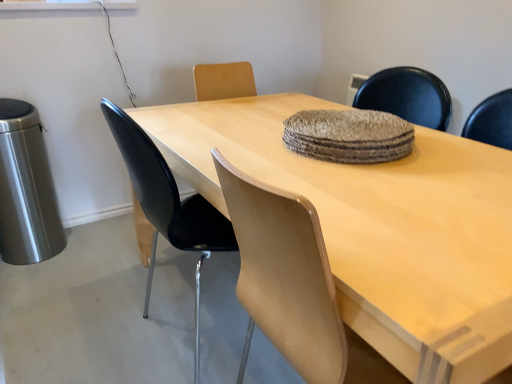
The height and width of the screenshot is (384, 512). Describe the element at coordinates (379, 228) in the screenshot. I see `light wood table at center` at that location.

The width and height of the screenshot is (512, 384). I want to click on textured woven mat at center, so click(349, 136).

The height and width of the screenshot is (384, 512). I want to click on black plastic chair at left, so click(x=168, y=205).

From a real-world perspective, between light wood table at center and black plastic chair at left, who is vertically higher?

black plastic chair at left, from a real-world perspective.

Based on the photo, can you confirm if light wood table at center is positioned to the left of black plastic chair at left?

Incorrect, light wood table at center is not on the left side of black plastic chair at left.

Is light wood table at center positioned in front of black plastic chair at left?

Yes, it is.

Is point (162, 196) positioned before point (396, 138)?

Yes, point (162, 196) is in front of point (396, 138).

Can textured woven mat at center be found inside black plastic chair at left?

→ That's incorrect, textured woven mat at center is not inside black plastic chair at left.

How many degrees apart are the facing directions of black plastic chair at left and textured woven mat at center?

The angle between the facing direction of black plastic chair at left and the facing direction of textured woven mat at center is 179 degrees.

From a real-world perspective, who is located higher, black plastic chair at left or textured woven mat at center?

textured woven mat at center is physically above.

Does point (345, 254) come closer to viewer compared to point (406, 145)?

Yes.

Is light wood table at center placed right next to textured woven mat at center?

light wood table at center and textured woven mat at center are not in contact.

Does light wood table at center have a smaller size compared to textured woven mat at center?

No, light wood table at center is not smaller than textured woven mat at center.

Is textured woven mat at center positioned before light wood table at center?

No, it is not.

Between point (322, 147) and point (348, 323), which one is positioned behind?

The point (322, 147) is behind.

From the image's perspective, who appears lower, textured woven mat at center or light wood table at center?

From the image's view, light wood table at center is below.

Can you see textured woven mat at center touching light wood table at center?

No, textured woven mat at center is not touching light wood table at center.

Does black plastic chair at left appear on the right side of light wood table at center?

No, black plastic chair at left is not to the right of light wood table at center.

Considering the positions of objects black plastic chair at left and light wood table at center in the image provided, who is in front, black plastic chair at left or light wood table at center?

light wood table at center is more forward.

Looking at this image, from a real-world perspective, is black plastic chair at left on light wood table at center?

Yes, from a real-world perspective, black plastic chair at left is on top of light wood table at center.

Considering the relative sizes of black plastic chair at left and light wood table at center in the image provided, is black plastic chair at left smaller than light wood table at center?

Yes, black plastic chair at left is smaller than light wood table at center.

Between textured woven mat at center and black plastic chair at left, which one has more height?

Standing taller between the two is black plastic chair at left.

Which object is positioned more to the left, textured woven mat at center or black plastic chair at left?

black plastic chair at left.

Considering their positions, is textured woven mat at center located in front of or behind black plastic chair at left?

textured woven mat at center is behind black plastic chair at left.

Can you tell me how much textured woven mat at center and black plastic chair at left differ in facing direction?

textured woven mat at center and black plastic chair at left are facing 179 degrees away from each other.

Where is `table below the black plastic chair at left (from the image's perspective)`? table below the black plastic chair at left (from the image's perspective) is located at coordinates (379, 228).

Where is `chair lying on the left of textured woven mat at center`? This screenshot has height=384, width=512. chair lying on the left of textured woven mat at center is located at coordinates (168, 205).

Based on their spatial positions, is light wood table at center or black plastic chair at left closer to textured woven mat at center?

light wood table at center is positioned closer to the anchor textured woven mat at center.

Which object lies nearer to the anchor point black plastic chair at left, textured woven mat at center or light wood table at center?

The object closer to black plastic chair at left is light wood table at center.

Considering their positions, is light wood table at center positioned further to black plastic chair at left than textured woven mat at center?

The object further to black plastic chair at left is textured woven mat at center.

Based on their spatial positions, is black plastic chair at left or textured woven mat at center further from light wood table at center?

black plastic chair at left is further to light wood table at center.

Looking at the image, which one is located closer to light wood table at center, textured woven mat at center or black plastic chair at left?

textured woven mat at center lies closer to light wood table at center than the other object.

From the image, which object appears to be nearer to textured woven mat at center, black plastic chair at left or light wood table at center?

Among the two, light wood table at center is located nearer to textured woven mat at center.

Locate an element on the screen. The height and width of the screenshot is (384, 512). chair located between light wood table at center and textured woven mat at center in the depth direction is located at coordinates (168, 205).